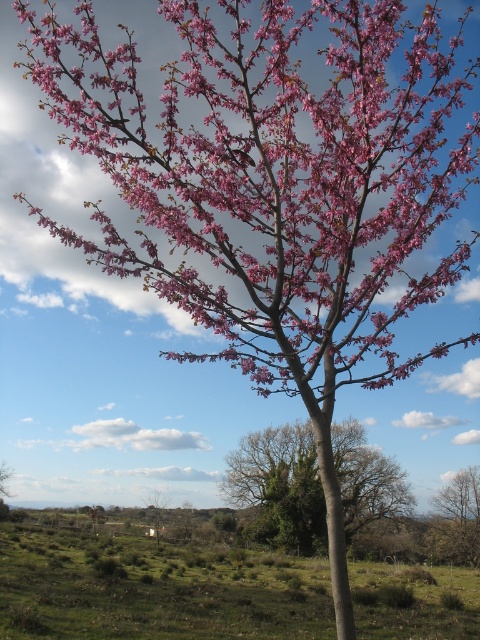
Does pink matte flowers at upper center have a lesser height compared to bare branches at lower right?

In fact, pink matte flowers at upper center may be taller than bare branches at lower right.

Does pink matte flowers at upper center have a smaller size compared to bare branches at lower right?

No, pink matte flowers at upper center is not smaller than bare branches at lower right.

Image resolution: width=480 pixels, height=640 pixels. Find the location of `pink matte flowers at upper center`. pink matte flowers at upper center is located at coordinates (274, 179).

How distant is pink matte flowers at upper center from pink matte tree at center?

37.26 meters

Is pink matte flowers at upper center smaller than pink matte tree at center?

Yes, pink matte flowers at upper center is smaller than pink matte tree at center.

Does point (427, 113) come closer to viewer compared to point (12, 468)?

Yes, it is in front of point (12, 468).

Where is `pink matte flowers at upper center`? The image size is (480, 640). pink matte flowers at upper center is located at coordinates (274, 179).

Does bare branches at lower right have a larger size compared to green matte house at center?

Actually, bare branches at lower right might be smaller than green matte house at center.

Looking at this image, between bare branches at lower right and green matte house at center, which one appears on the left side from the viewer's perspective?

From the viewer's perspective, green matte house at center appears more on the left side.

You are a GUI agent. You are given a task and a screenshot of the screen. Output one action in this format:
    pyautogui.click(x=<x>, y=<y>)
    Task: Click on the bare branches at lower right
    
    Given the screenshot: What is the action you would take?
    pyautogui.click(x=456, y=518)